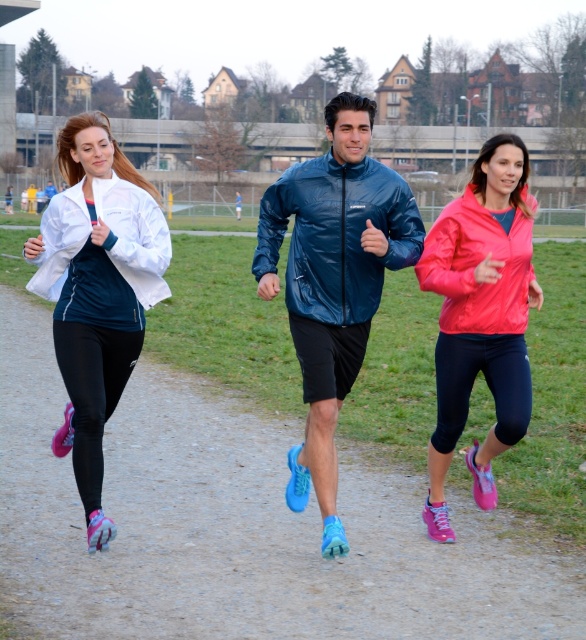
Question: Which point appears closest to the camera in this image?

Choices:
 (A) (345, 205)
 (B) (512, 420)

Answer: (B)

Question: Does glossy blue jacket at center appear under matte pink jacket at right?

Choices:
 (A) yes
 (B) no

Answer: (B)

Question: From the image, what is the correct spatial relationship of matte pink jacket at center in relation to glossy blue jacket at center?

Choices:
 (A) left
 (B) right

Answer: (B)

Question: Which of the following is the closest to the observer?

Choices:
 (A) (314, 202)
 (B) (132, 356)

Answer: (A)

Question: Which point appears closest to the camera in this image?

Choices:
 (A) (362, 184)
 (B) (461, 289)
 (C) (329, 216)
 (D) (22, 294)

Answer: (B)

Question: Is matte blue sneakers at center to the right of matte pink jacket at center from the viewer's perspective?

Choices:
 (A) no
 (B) yes

Answer: (A)